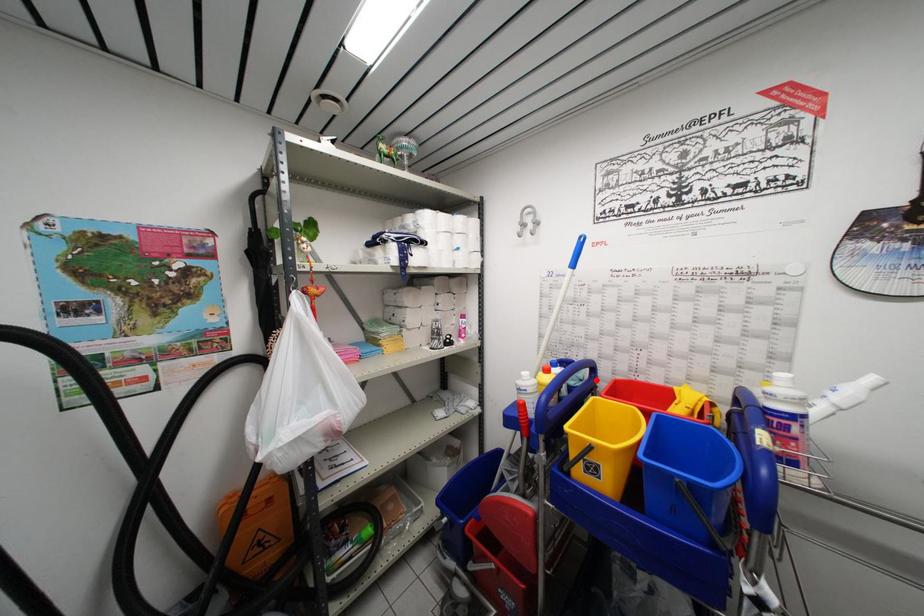
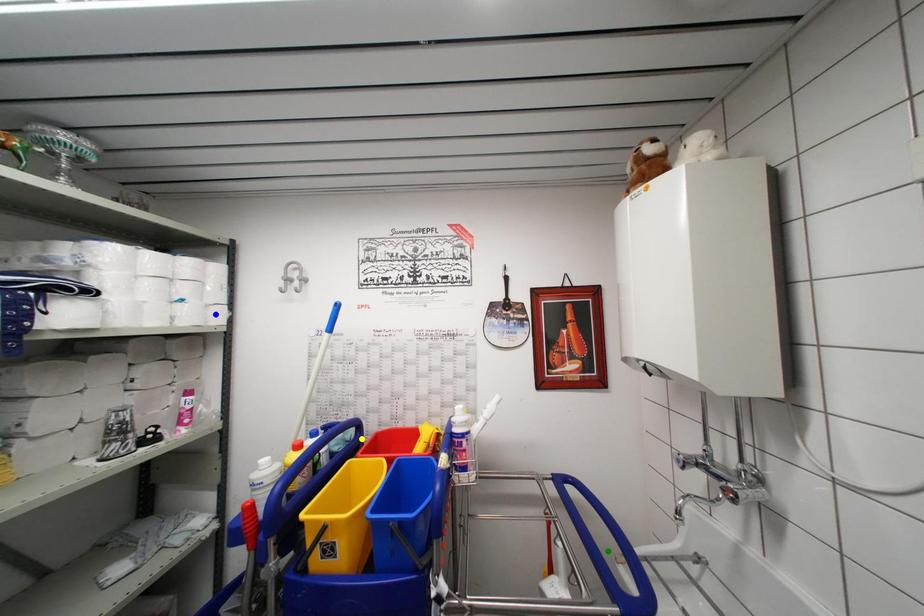
Question: I am providing you with two images of the same scene from different viewpoints. A red point is marked on the first image. You are given multiple points on the second image. In image 2, which mark is for the same physical point as the one in image 1?

Choices:
 (A) green point
 (B) blue point
 (C) yellow point

Answer: (C)